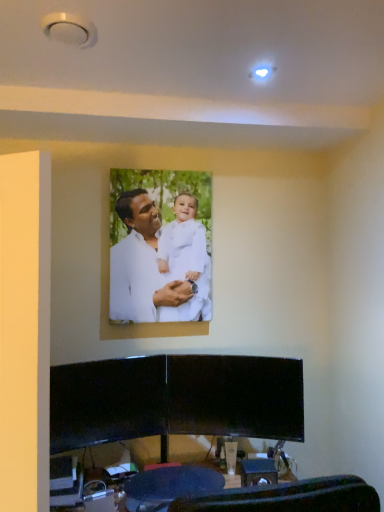
Question: Is white matte/soft fabric man at center oriented away from dark blue fabric swivel chair at lower center?

Choices:
 (A) yes
 (B) no

Answer: (B)

Question: From a real-world perspective, is white matte/soft fabric man at center below dark blue fabric swivel chair at lower center?

Choices:
 (A) no
 (B) yes

Answer: (A)

Question: From the image's perspective, would you say white matte/soft fabric man at center is shown under dark blue fabric swivel chair at lower center?

Choices:
 (A) yes
 (B) no

Answer: (B)

Question: From the image's perspective, would you say white matte/soft fabric man at center is positioned over dark blue fabric swivel chair at lower center?

Choices:
 (A) yes
 (B) no

Answer: (A)

Question: Would you say white matte/soft fabric man at center is a long distance from dark blue fabric swivel chair at lower center?

Choices:
 (A) no
 (B) yes

Answer: (A)

Question: From a real-world perspective, is white matte/soft fabric man at center located higher than dark blue fabric swivel chair at lower center?

Choices:
 (A) yes
 (B) no

Answer: (A)

Question: Is black glossy entertainment center at lower center behind dark blue fabric swivel chair at lower center?

Choices:
 (A) no
 (B) yes

Answer: (A)

Question: Considering the relative positions of black glossy entertainment center at lower center and dark blue fabric swivel chair at lower center in the image provided, is black glossy entertainment center at lower center to the right of dark blue fabric swivel chair at lower center from the viewer's perspective?

Choices:
 (A) no
 (B) yes

Answer: (B)

Question: Can you confirm if black glossy entertainment center at lower center is thinner than dark blue fabric swivel chair at lower center?

Choices:
 (A) yes
 (B) no

Answer: (B)

Question: From the image's perspective, does black glossy entertainment center at lower center appear higher than dark blue fabric swivel chair at lower center?

Choices:
 (A) no
 (B) yes

Answer: (B)

Question: Is black glossy entertainment center at lower center to the left of dark blue fabric swivel chair at lower center from the viewer's perspective?

Choices:
 (A) yes
 (B) no

Answer: (B)

Question: Is black glossy entertainment center at lower center closer to camera compared to dark blue fabric swivel chair at lower center?

Choices:
 (A) no
 (B) yes

Answer: (B)

Question: From a real-world perspective, is white matte/soft fabric man at center positioned under black glossy entertainment center at lower center based on gravity?

Choices:
 (A) yes
 (B) no

Answer: (B)